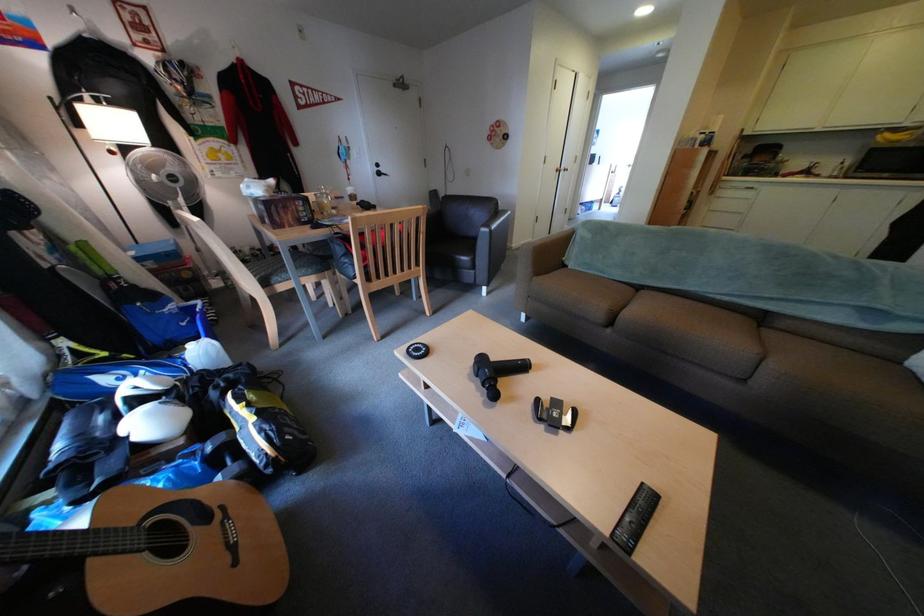
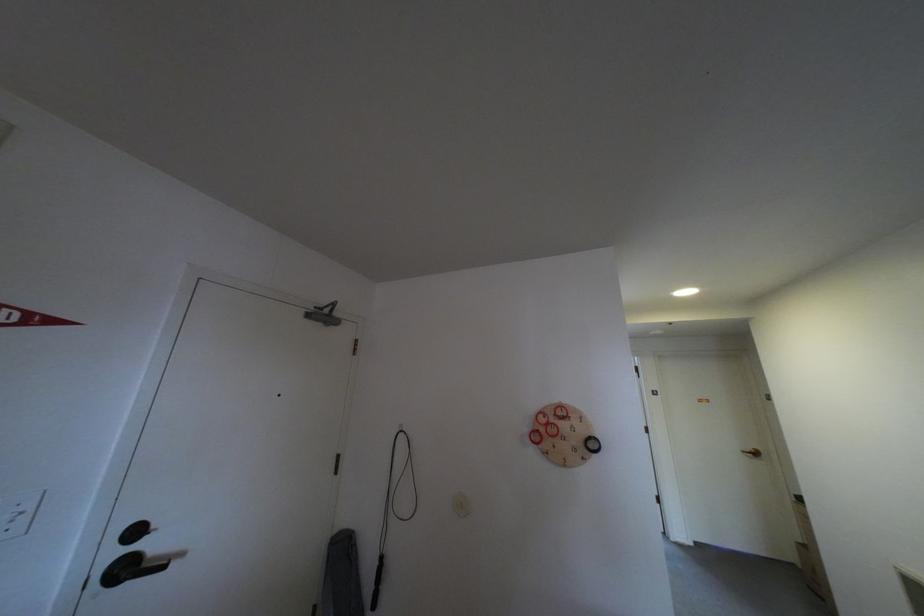
Locate, in the second image, the point that corresponds to (393,175) in the first image.

(140, 570)